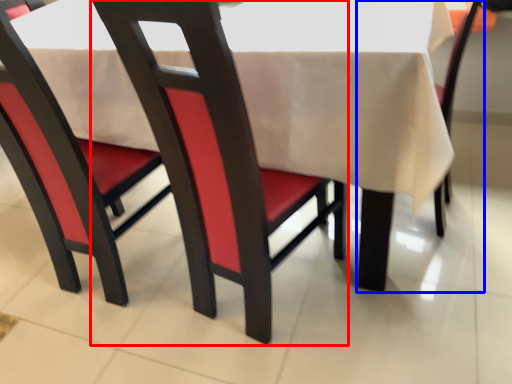
Question: Which point is closer to the camera, chair (highlighted by a red box) or chair (highlighted by a blue box)?

Choices:
 (A) chair
 (B) chair

Answer: (A)